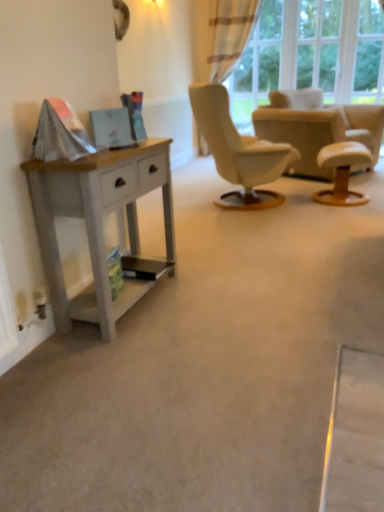
Question: Can white leather stool at right be found inside plaid fabric curtain at upper right?

Choices:
 (A) no
 (B) yes

Answer: (A)

Question: From the image's perspective, would you say plaid fabric curtain at upper right is positioned over white leather stool at right?

Choices:
 (A) yes
 (B) no

Answer: (A)

Question: Can you confirm if plaid fabric curtain at upper right is smaller than white leather stool at right?

Choices:
 (A) no
 (B) yes

Answer: (A)

Question: Is plaid fabric curtain at upper right positioned in front of white leather stool at right?

Choices:
 (A) yes
 (B) no

Answer: (B)

Question: Does plaid fabric curtain at upper right come behind white leather stool at right?

Choices:
 (A) no
 (B) yes

Answer: (B)

Question: Considering the relative sizes of plaid fabric curtain at upper right and white leather stool at right in the image provided, is plaid fabric curtain at upper right bigger than white leather stool at right?

Choices:
 (A) no
 (B) yes

Answer: (B)

Question: Could you tell me if plaid fabric curtain at upper right is turned towards beige fabric armchair at center?

Choices:
 (A) yes
 (B) no

Answer: (B)

Question: Can you confirm if plaid fabric curtain at upper right is positioned to the right of beige fabric armchair at center?

Choices:
 (A) yes
 (B) no

Answer: (B)

Question: From a real-world perspective, is plaid fabric curtain at upper right positioned under beige fabric armchair at center based on gravity?

Choices:
 (A) no
 (B) yes

Answer: (A)

Question: Is plaid fabric curtain at upper right next to beige fabric armchair at center and touching it?

Choices:
 (A) yes
 (B) no

Answer: (B)

Question: Considering the relative sizes of plaid fabric curtain at upper right and beige fabric armchair at center in the image provided, is plaid fabric curtain at upper right thinner than beige fabric armchair at center?

Choices:
 (A) yes
 (B) no

Answer: (A)

Question: Is plaid fabric curtain at upper right further to camera compared to beige fabric armchair at center?

Choices:
 (A) no
 (B) yes

Answer: (B)

Question: Is beige fabric armchair at center not inside plaid fabric curtain at upper right?

Choices:
 (A) yes
 (B) no

Answer: (A)